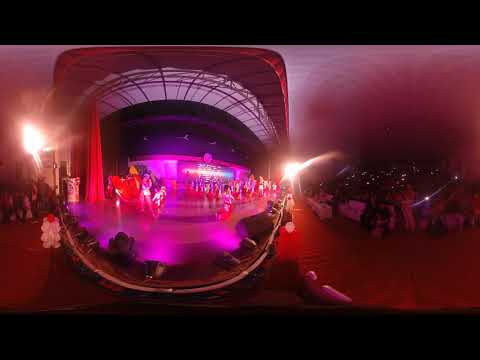
Identify the location of stage ceiling. (183, 93).